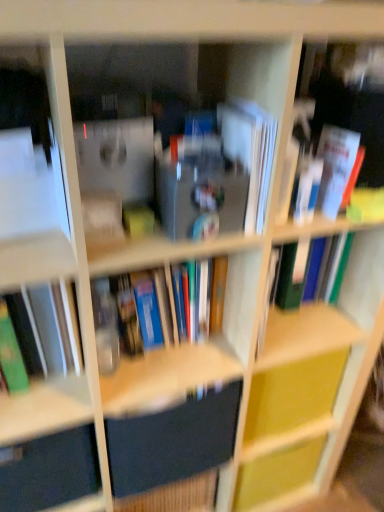
At what (x,y) coordinates should I click in order to perform the action: click on blank space situated above dark blue matte book at center, positioned as the second paperback book in top-to-bottom order (from a real-world perspective). Please return your answer as a coordinate pair (x, y). This screenshot has height=512, width=384. Looking at the image, I should click on (182, 381).